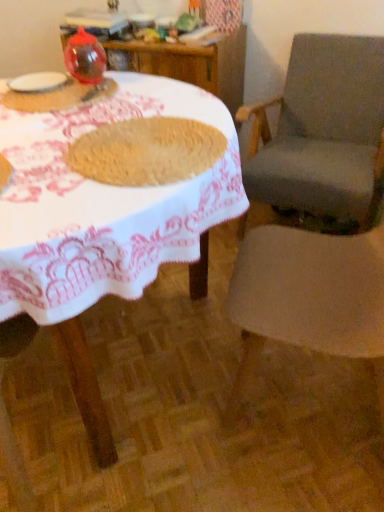
The image size is (384, 512). I want to click on free space that is in between brown woven mat at center and translucent plastic cup at upper left, the 3th tableware in the top-to-bottom sequence, so click(104, 117).